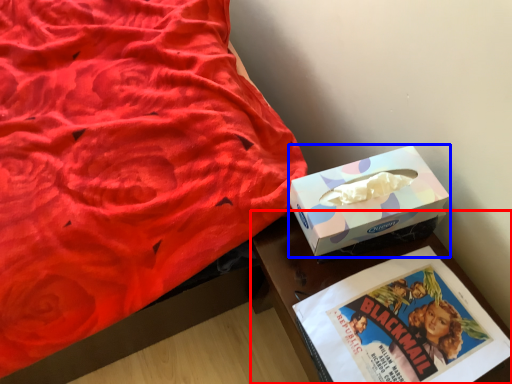
Question: Which point is further to the camera, table (highlighted by a red box) or box (highlighted by a blue box)?

Choices:
 (A) table
 (B) box

Answer: (B)